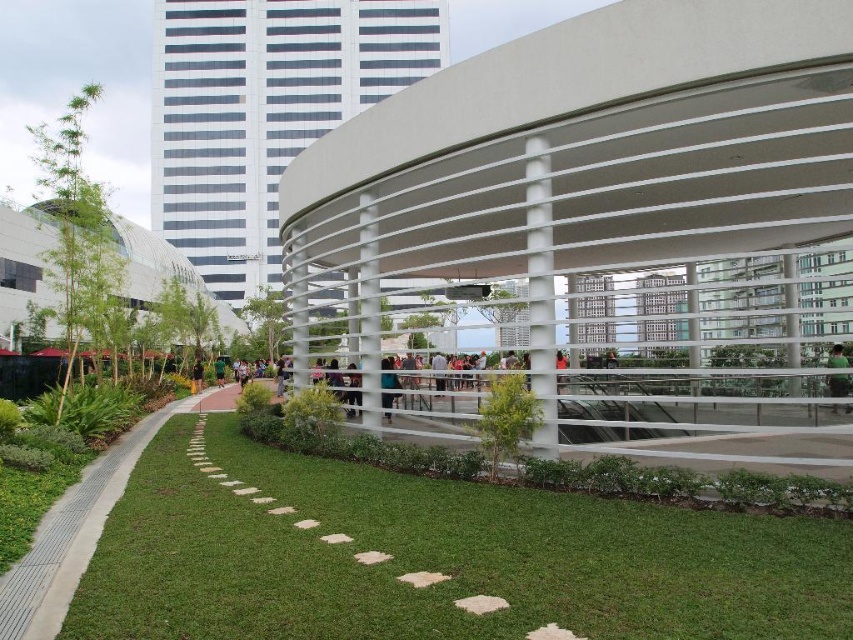
Between black fabric person at lower left and green fabric shirt at center, which one has less height?

With less height is green fabric shirt at center.

Does black fabric person at lower left have a lesser width compared to green fabric shirt at center?

Yes, black fabric person at lower left is thinner than green fabric shirt at center.

Is point (194, 364) positioned in front of point (219, 387)?

No, it is behind (219, 387).

Identify the location of black fabric person at lower left. click(x=196, y=376).

Looking at this image, between green fabric at center and green fabric shirt at center, which one has less height?

With less height is green fabric at center.

Who is positioned more to the left, green fabric at center or green fabric shirt at center?

From the viewer's perspective, green fabric shirt at center appears more on the left side.

Where is `green fabric at center`? Image resolution: width=853 pixels, height=640 pixels. green fabric at center is located at coordinates (838, 385).

You are a GUI agent. You are given a task and a screenshot of the screen. Output one action in this format:
    pyautogui.click(x=<x>, y=<y>)
    Task: Click on the green fabric at center
    
    Given the screenshot: What is the action you would take?
    pyautogui.click(x=838, y=385)

Does green fabric at center lie in front of matte black person at center?

That is True.

You are a GUI agent. You are given a task and a screenshot of the screen. Output one action in this format:
    pyautogui.click(x=<x>, y=<y>)
    Task: Click on the green fabric at center
    
    Given the screenshot: What is the action you would take?
    pyautogui.click(x=838, y=385)